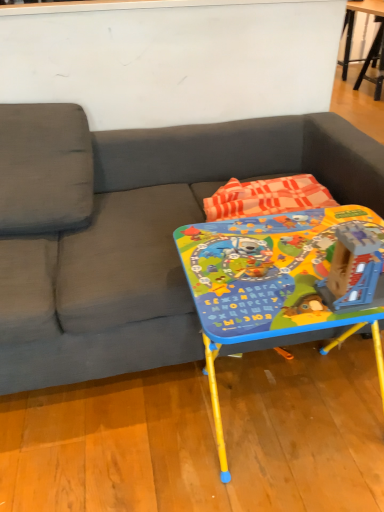
I want to click on vacant area on the back side of plastic blue building at center, so click(303, 242).